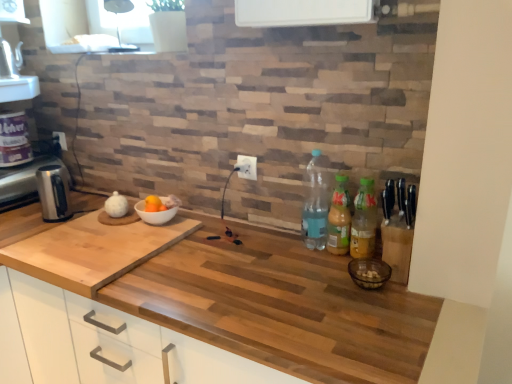
Question: In the image, is translucent plastic bottles at right, acting as the 2th bottle starting from the right, on the left side or the right side of satin silver kettle at left?

Choices:
 (A) right
 (B) left

Answer: (A)

Question: Is point (339, 178) closer or farther from the camera than point (59, 170)?

Choices:
 (A) farther
 (B) closer

Answer: (B)

Question: Which is nearer to the white plastic electric outlet at center, which ranks as the 1th electric outlet in front-to-back order?

Choices:
 (A) green plastic bottles at right, which is the 1th bottle from right to left
 (B) satin silver kettle at left
 (C) natural wood cutting board at left, marked as the 2th countertop in a bottom-to-top arrangement
 (D) transparent glass window at upper left
 (E) wooden at center, marked as the 2th countertop in a top-to-bottom arrangement

Answer: (A)

Question: Based on their relative distances, which object is nearer to the white plastic electric outlet at center, arranged as the first electric outlet when viewed from the right?

Choices:
 (A) white plastic electric outlet at upper center, the 1th electric outlet positioned from the left
 (B) natural wood cutting board at left, which appears as the first countertop when viewed from the top
 (C) translucent plastic bottle at right, which ranks as the 1th bottle in left-to-right order
 (D) green plastic bottles at right, which appears as the third bottle when viewed from the left
 (E) satin silver kettle at left

Answer: (C)